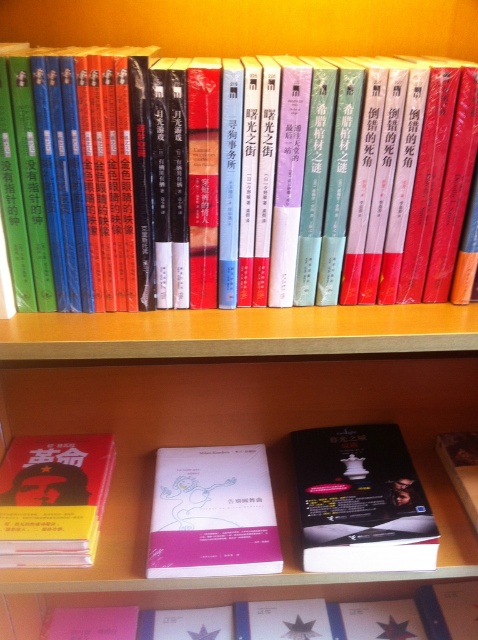
Question: Among these objects, which one is farthest from the camera?

Choices:
 (A) hardcover book at center
 (B) red matte book at lower left

Answer: (B)

Question: Which point is closer to the camera?

Choices:
 (A) (185, 508)
 (B) (403, 532)
 (C) (4, 547)

Answer: (C)

Question: Is black matte book at center to the left of pink matte book at center from the viewer's perspective?

Choices:
 (A) yes
 (B) no

Answer: (B)

Question: Is hardcover book at center positioned at the back of black matte book at center?

Choices:
 (A) yes
 (B) no

Answer: (B)

Question: Which point is closer to the camera taking this photo?

Choices:
 (A) (303, 541)
 (B) (267, 554)
 (C) (414, 112)
 (D) (76, 474)

Answer: (C)

Question: From the image, what is the correct spatial relationship of hardcover book at center in relation to red matte book at lower left?

Choices:
 (A) below
 (B) above

Answer: (B)